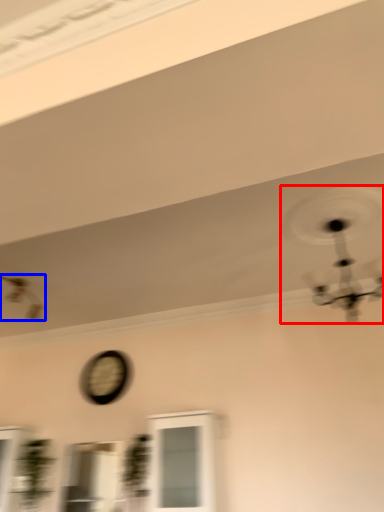
Question: Which object appears farthest to the camera in this image, mechanical fan (highlighted by a red box) or mechanical fan (highlighted by a blue box)?

Choices:
 (A) mechanical fan
 (B) mechanical fan

Answer: (B)